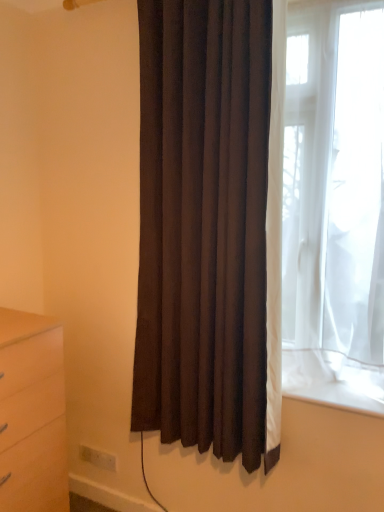
Question: Is white plastic electric outlet at lower left directly adjacent to dark brown fabric curtain at center?

Choices:
 (A) yes
 (B) no

Answer: (B)

Question: Does white plastic electric outlet at lower left have a lesser width compared to dark brown fabric curtain at center?

Choices:
 (A) no
 (B) yes

Answer: (B)

Question: Does white plastic electric outlet at lower left come behind dark brown fabric curtain at center?

Choices:
 (A) no
 (B) yes

Answer: (B)

Question: From a real-world perspective, is white plastic electric outlet at lower left physically above dark brown fabric curtain at center?

Choices:
 (A) no
 (B) yes

Answer: (A)

Question: From the image's perspective, would you say white plastic electric outlet at lower left is positioned over dark brown fabric curtain at center?

Choices:
 (A) no
 (B) yes

Answer: (A)

Question: Does white plastic electric outlet at lower left have a greater height compared to dark brown fabric curtain at center?

Choices:
 (A) yes
 (B) no

Answer: (B)

Question: Is dark brown fabric curtain at center surrounding white plastic electric outlet at lower left?

Choices:
 (A) yes
 (B) no

Answer: (B)

Question: From the image's perspective, does dark brown fabric curtain at center appear lower than white plastic electric outlet at lower left?

Choices:
 (A) no
 (B) yes

Answer: (A)

Question: Is dark brown fabric curtain at center closer to the viewer compared to white plastic electric outlet at lower left?

Choices:
 (A) no
 (B) yes

Answer: (B)

Question: Is dark brown fabric curtain at center at the left side of white plastic electric outlet at lower left?

Choices:
 (A) yes
 (B) no

Answer: (B)

Question: Is the depth of dark brown fabric curtain at center greater than that of white plastic electric outlet at lower left?

Choices:
 (A) no
 (B) yes

Answer: (A)

Question: From the image's perspective, does dark brown fabric curtain at center appear higher than white plastic electric outlet at lower left?

Choices:
 (A) yes
 (B) no

Answer: (A)

Question: From the image's perspective, is matte wood chest of drawers at lower left beneath white plastic electric outlet at lower left?

Choices:
 (A) yes
 (B) no

Answer: (B)